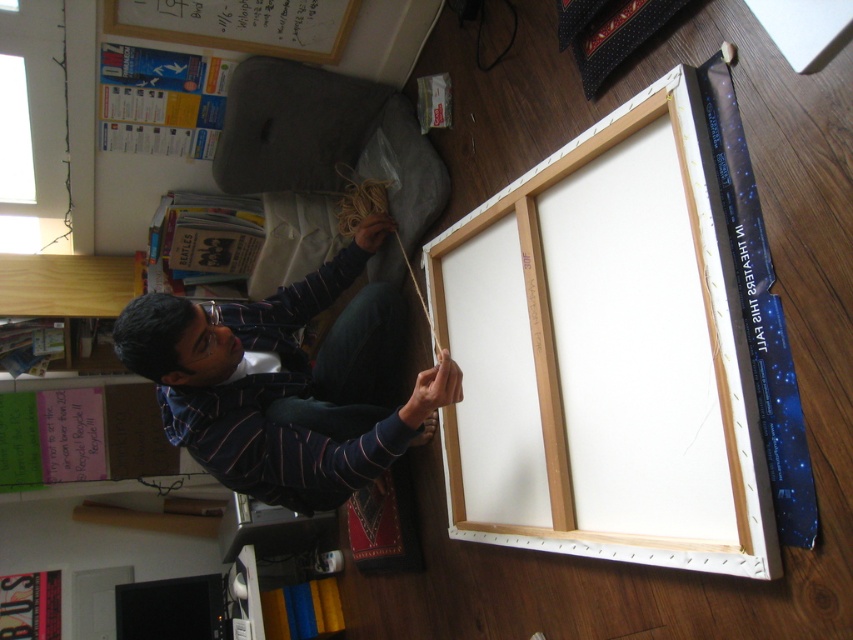
You are a guest in the room and want to hand the person a book from the bookshelf located to their left. Since the white matte canvas at center and the striped shirt at lower left are in your line of sight, which object should you move around to avoid blocking their view?

The white matte canvas at center is in front of the striped shirt at lower left, so you should move around the white matte canvas at center to avoid blocking their view.

From the picture: You are a guest in the room and want to describe the position of the white matte canvas at center relative to the striped shirt at lower left. How would you phrase that?

The white matte canvas at center is positioned to the right of the striped shirt at lower left.